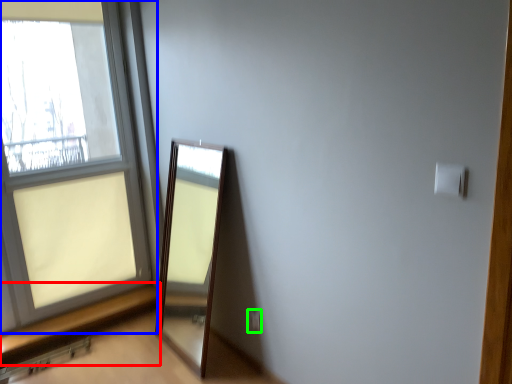
Question: Based on their relative distances, which object is farther from window sill (highlighted by a red box)? Choose from window (highlighted by a blue box) and electric outlet (highlighted by a green box).

Choices:
 (A) window
 (B) electric outlet

Answer: (B)